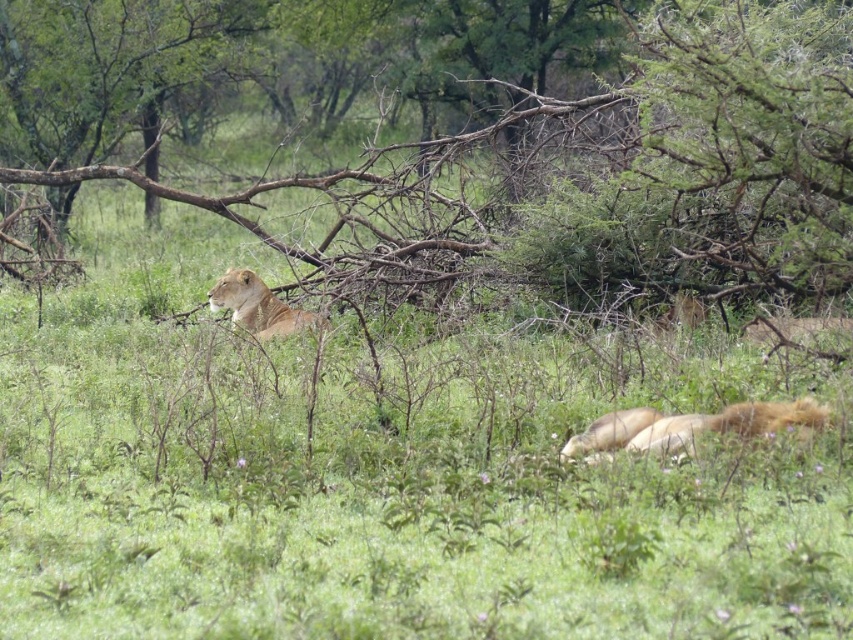
You are a photographer trying to capture a wide shot of the golden fur lioness at upper left and the brown wood tree at upper center. Based on their sizes, which one should you focus on first to ensure both are in frame?

The brown wood tree at upper center might be wider than golden fur lioness at upper left, so you should focus on the brown wood tree at upper center first to ensure both fit in the frame.

You are a photographer trying to capture a clear shot of the golden fur lion at lower right without the brown wood tree at upper center blocking the view. Based on their positions, can you position yourself in a way to avoid the tree?

The brown wood tree at upper center is positioned on the left side of golden fur lion at lower right. To avoid the tree blocking the view, the photographer should position themselves to the right side of the lion so that the tree is out of frame or behind the lion.